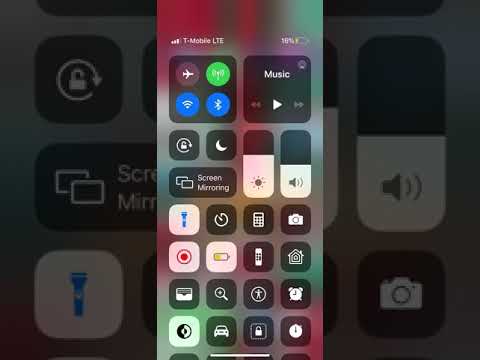
At what (x,y) coordinates should I click in order to perform the action: click on phone screen. Please return your answer as a coordinate pair (x, y). Looking at the image, I should click on (465, 232).